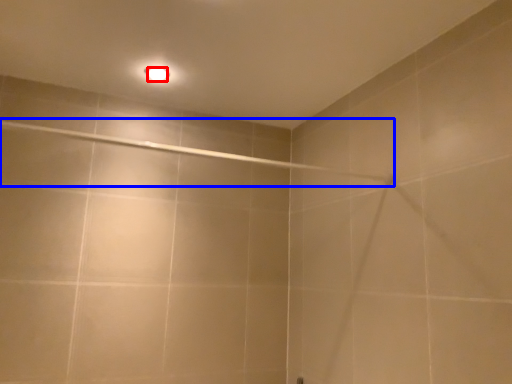
Question: Among these objects, which one is farthest to the camera, light bulb (highlighted by a red box) or shower (highlighted by a blue box)?

Choices:
 (A) light bulb
 (B) shower

Answer: (A)